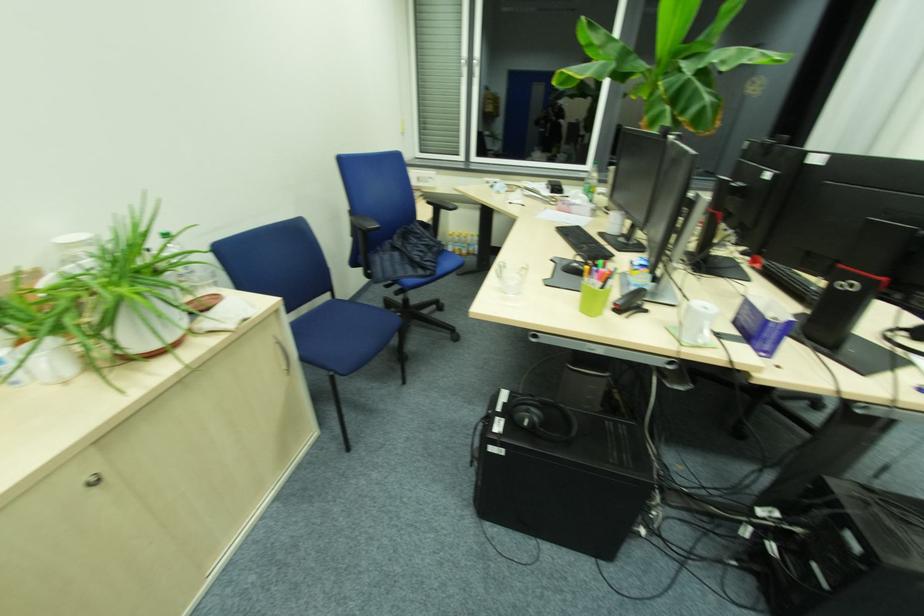
Describe the element at coordinates (476, 67) in the screenshot. I see `the window handle` at that location.